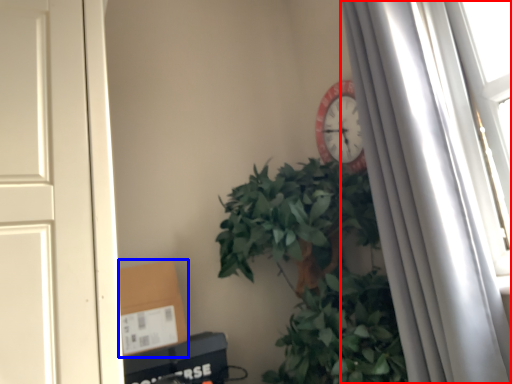
Question: Which of the following is the farthest to the observer, curtain (highlighted by a red box) or cardboard box (highlighted by a blue box)?

Choices:
 (A) curtain
 (B) cardboard box

Answer: (B)